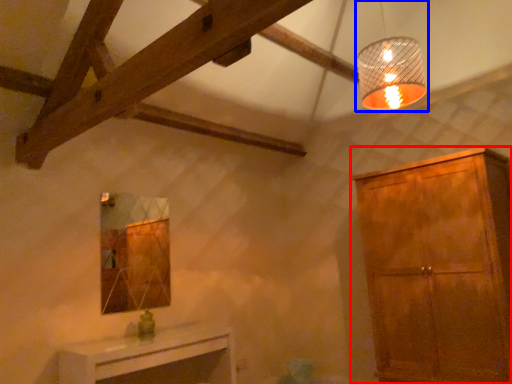
Question: Which of the following is the closest to the observer, cabinetry (highlighted by a red box) or lamp (highlighted by a blue box)?

Choices:
 (A) cabinetry
 (B) lamp

Answer: (B)